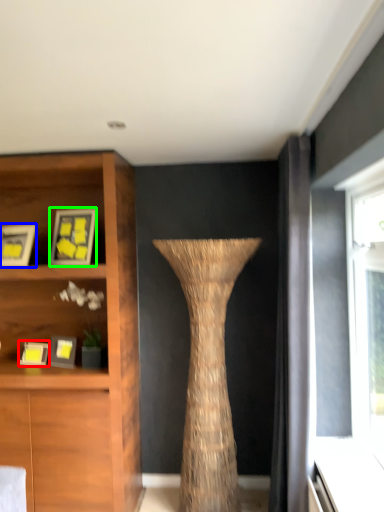
Question: Based on their relative distances, which object is nearer to picture frame (highlighted by a red box)? Choose from picture frame (highlighted by a blue box) and picture frame (highlighted by a green box).

Choices:
 (A) picture frame
 (B) picture frame

Answer: (A)